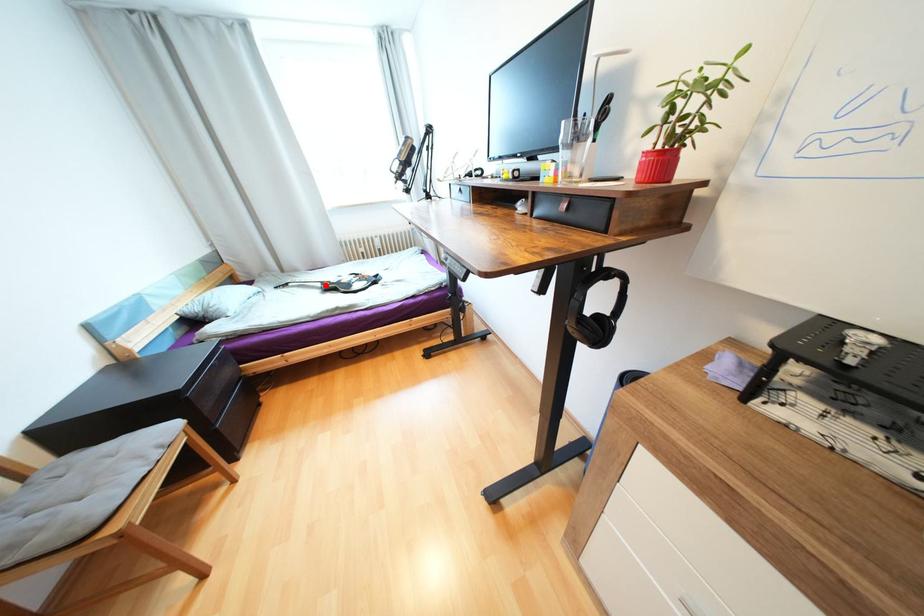
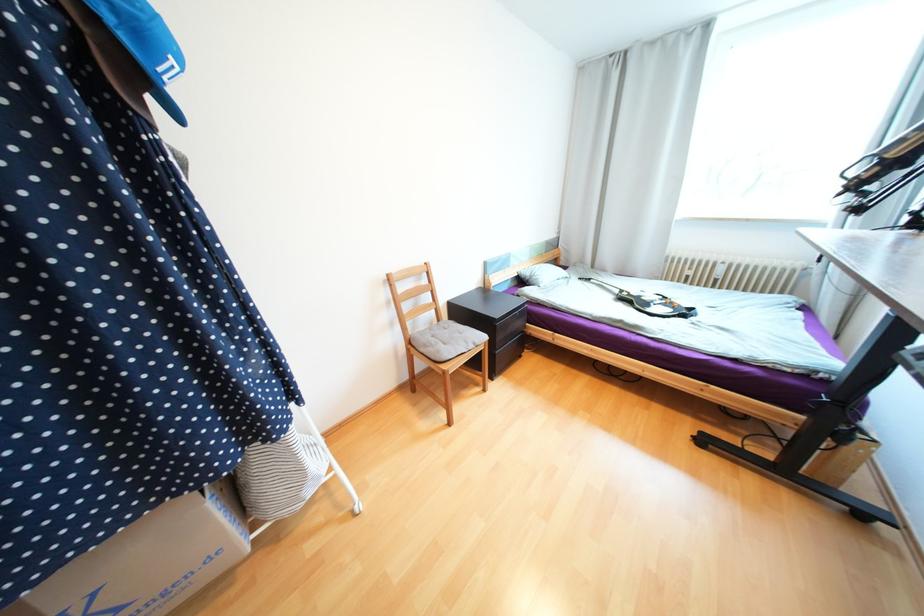
Locate, in the second image, the point that corresponds to the highlighted location in the first image.

(623, 292)